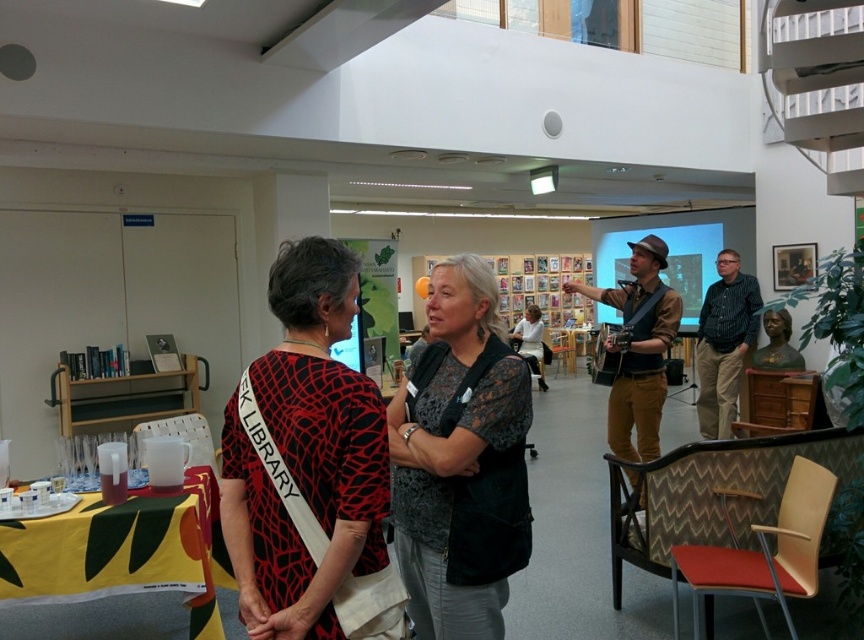
Question: Can you confirm if red and black printed blouse at center is thinner than dark gray lace blouse at center?

Choices:
 (A) no
 (B) yes

Answer: (B)

Question: Is red and black printed blouse at center smaller than dark gray lace blouse at center?

Choices:
 (A) no
 (B) yes

Answer: (B)

Question: Does red and black printed blouse at center appear over dark gray lace blouse at center?

Choices:
 (A) yes
 (B) no

Answer: (A)

Question: Which point appears closest to the camera in this image?

Choices:
 (A) (248, 460)
 (B) (423, 448)

Answer: (A)